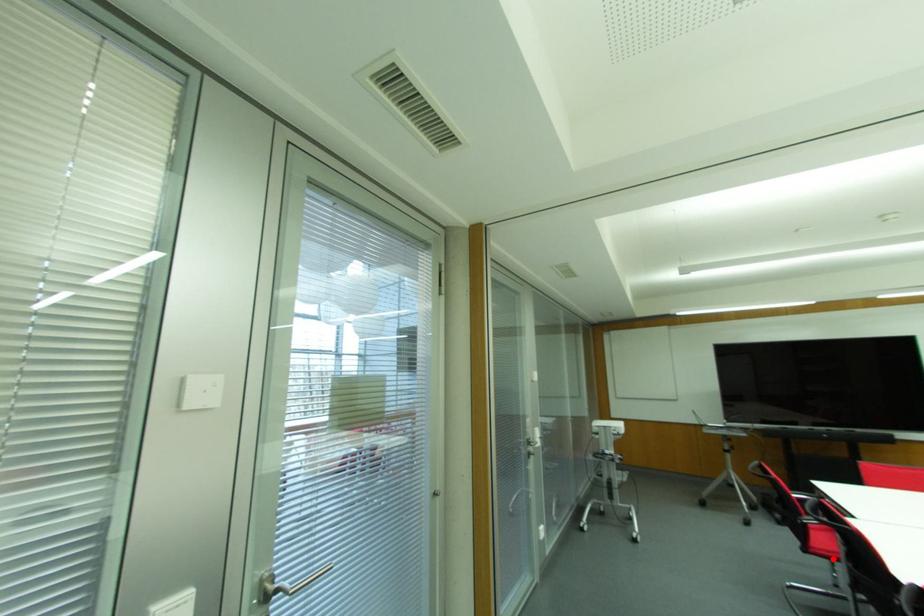
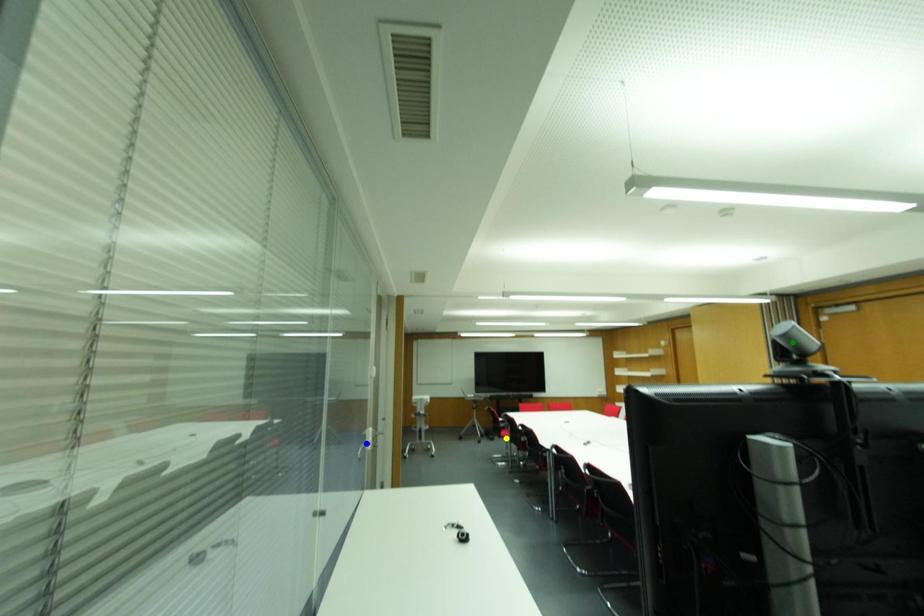
Question: I am providing you with two images of the same scene from different viewpoints. A red point is marked on the first image. You are given multiple points on the second image. Which point in image 2 is actually the same real-world point as the red point in image 1?

Choices:
 (A) green point
 (B) yellow point
 (C) blue point

Answer: (B)